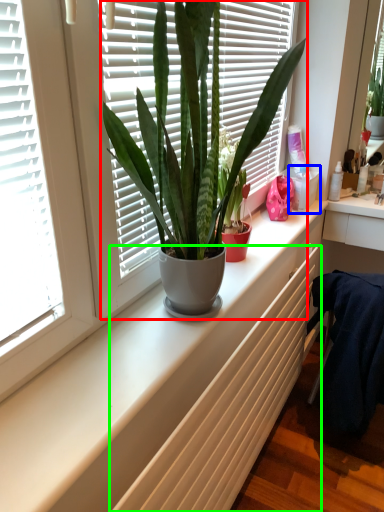
Question: Based on their relative distances, which object is nearer to houseplant (highlighted by a red box)? Choose from window box (highlighted by a blue box) and radiator (highlighted by a green box).

Choices:
 (A) window box
 (B) radiator

Answer: (B)